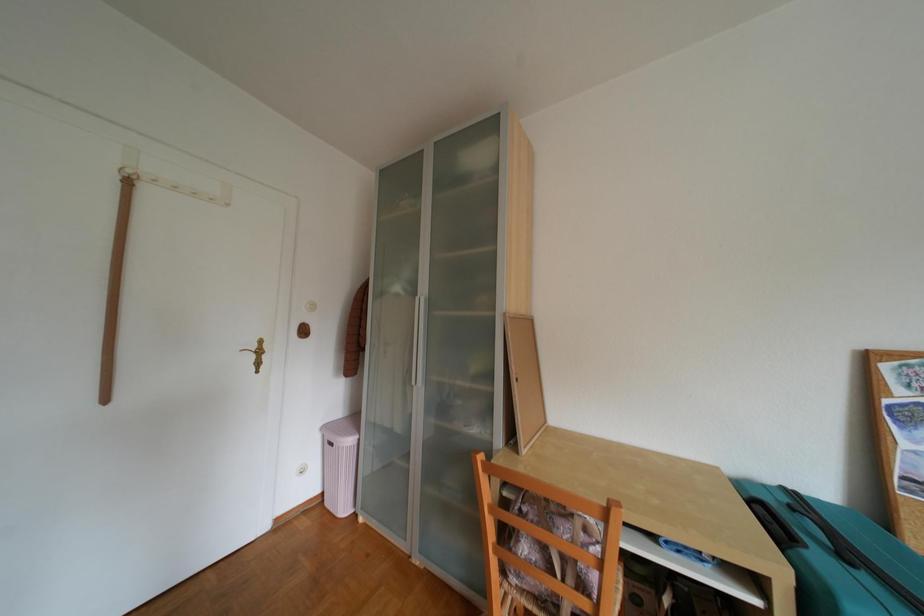
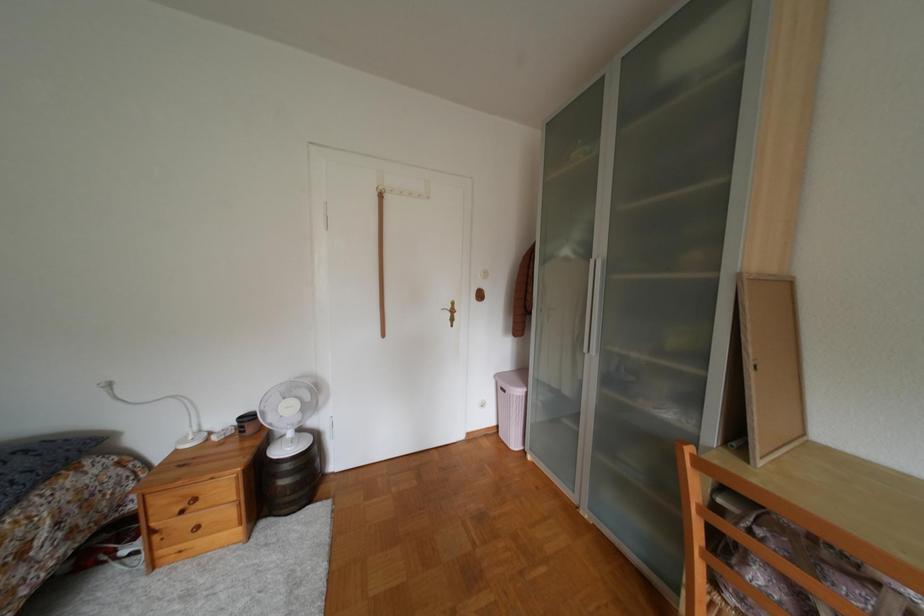
Question: The images are taken continuously from a first-person perspective. In which direction is your viewpoint rotating?

Choices:
 (A) Left
 (B) Right
 (C) Up
 (D) Down

Answer: (A)